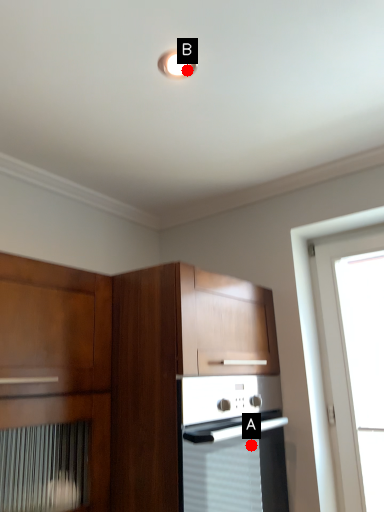
Question: Two points are circled on the image, labeled by A and B beside each circle. Among these points, which one is nearest to the camera?

Choices:
 (A) A is closer
 (B) B is closer

Answer: (B)